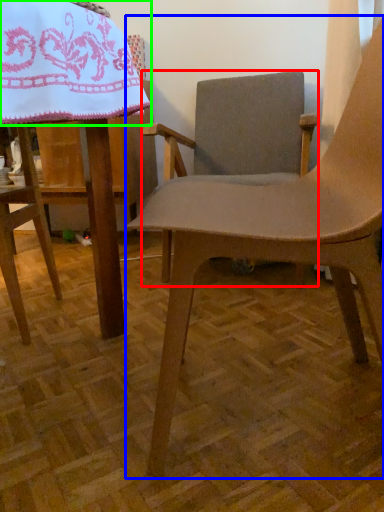
Question: Which object is the farthest from chair (highlighted by a red box)? Choose among these: chair (highlighted by a blue box) or blanket (highlighted by a green box).

Choices:
 (A) chair
 (B) blanket

Answer: (B)